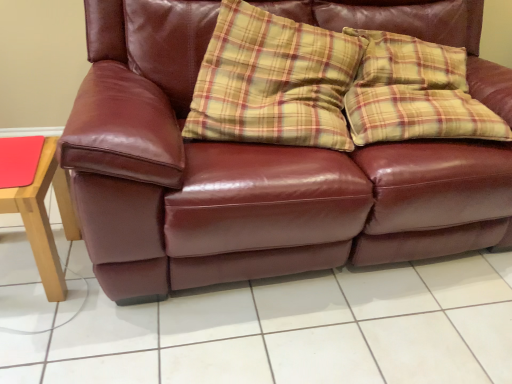
Question: Considering the relative positions of matte wood table at left and burgundy leather couch at center in the image provided, is matte wood table at left to the left of burgundy leather couch at center from the viewer's perspective?

Choices:
 (A) yes
 (B) no

Answer: (A)

Question: From a real-world perspective, is matte wood table at left below burgundy leather couch at center?

Choices:
 (A) yes
 (B) no

Answer: (A)

Question: From the image's perspective, is matte wood table at left under burgundy leather couch at center?

Choices:
 (A) yes
 (B) no

Answer: (A)

Question: Is matte wood table at left located outside burgundy leather couch at center?

Choices:
 (A) yes
 (B) no

Answer: (A)

Question: Does matte wood table at left have a smaller size compared to burgundy leather couch at center?

Choices:
 (A) no
 (B) yes

Answer: (B)

Question: Considering the positions of matte wood table at left and burgundy leather couch at center in the image, is matte wood table at left taller or shorter than burgundy leather couch at center?

Choices:
 (A) short
 (B) tall

Answer: (A)

Question: Does point (55, 190) appear closer or farther from the camera than point (96, 208)?

Choices:
 (A) closer
 (B) farther

Answer: (B)

Question: Which is correct: matte wood table at left is inside burgundy leather couch at center, or outside of it?

Choices:
 (A) inside
 (B) outside

Answer: (B)

Question: Considering the positions of matte wood table at left and burgundy leather couch at center in the image, is matte wood table at left wider or thinner than burgundy leather couch at center?

Choices:
 (A) wide
 (B) thin

Answer: (B)

Question: Do you think burgundy leather couch at center is within matte wood table at left, or outside of it?

Choices:
 (A) inside
 (B) outside

Answer: (B)

Question: Is burgundy leather couch at center wider or thinner than matte wood table at left?

Choices:
 (A) wide
 (B) thin

Answer: (A)

Question: Considering the relative positions of burgundy leather couch at center and matte wood table at left in the image provided, is burgundy leather couch at center to the left or to the right of matte wood table at left?

Choices:
 (A) right
 (B) left

Answer: (A)

Question: From a real-world perspective, is burgundy leather couch at center physically located above or below matte wood table at left?

Choices:
 (A) above
 (B) below

Answer: (A)

Question: From the image's perspective, relative to matte leather couch at center, is matte wood table at left above or below?

Choices:
 (A) above
 (B) below

Answer: (A)

Question: From their relative heights in the image, would you say matte wood table at left is taller or shorter than matte leather couch at center?

Choices:
 (A) tall
 (B) short

Answer: (A)